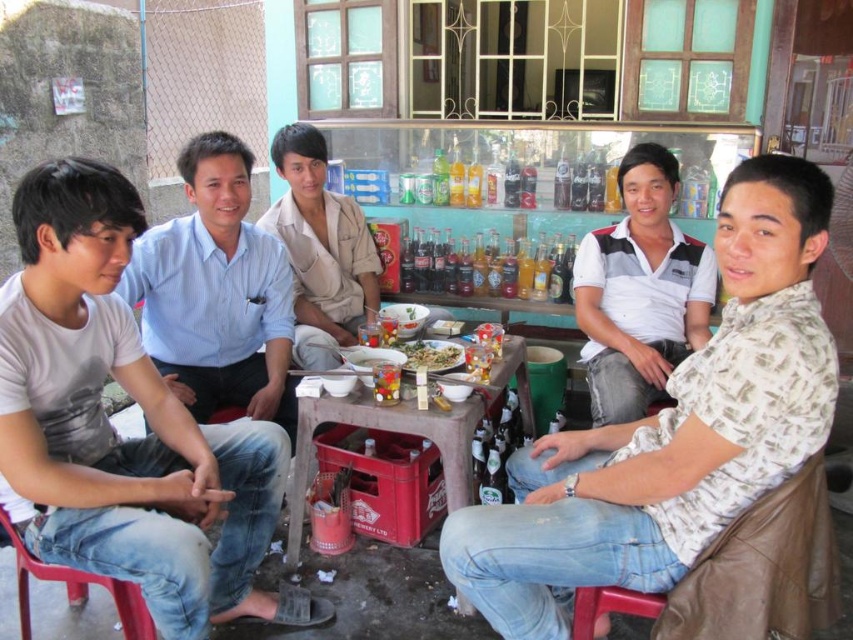
Question: Which point appears closest to the camera in this image?

Choices:
 (A) (503, 353)
 (B) (112, 202)
 (C) (605, 358)

Answer: (B)

Question: Can you confirm if white cotton shirt at left is positioned below white printed shirt at center?

Choices:
 (A) yes
 (B) no

Answer: (A)

Question: Observing the image, what is the correct spatial positioning of white striped polo shirt at center in reference to translucent glass bottles at center?

Choices:
 (A) right
 (B) left

Answer: (A)

Question: Based on their relative distances, which object is farther from the wooden table at center?

Choices:
 (A) white printed shirt at center
 (B) white cotton shirt at left
 (C) green matte bowl at center

Answer: (A)

Question: Estimate the real-world distances between objects in this image. Which object is closer to the white printed shirt at center?

Choices:
 (A) matte plastic bowls at center
 (B) light blue shirt at center
 (C) green matte bowl at center

Answer: (A)

Question: Can you confirm if white cotton shirt at left is positioned to the right of matte plastic bowls at center?

Choices:
 (A) yes
 (B) no

Answer: (B)